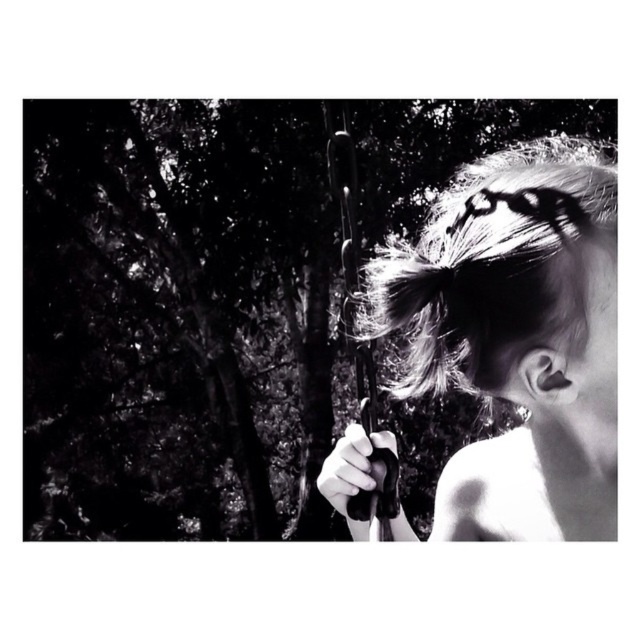
Is dark textured tree at upper left below shiny black hair at right?

No, dark textured tree at upper left is not below shiny black hair at right.

Which is more to the left, dark textured tree at upper left or shiny black hair at right?

dark textured tree at upper left is more to the left.

Between point (48, 211) and point (483, 387), which one is positioned in front?

Point (483, 387)

Where is `dark textured tree at upper left`? dark textured tree at upper left is located at coordinates (177, 316).